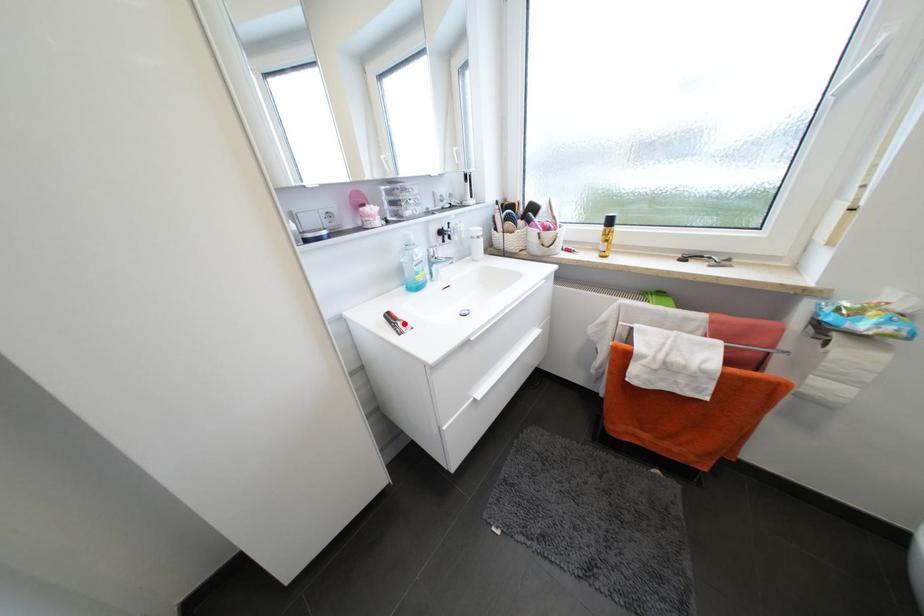
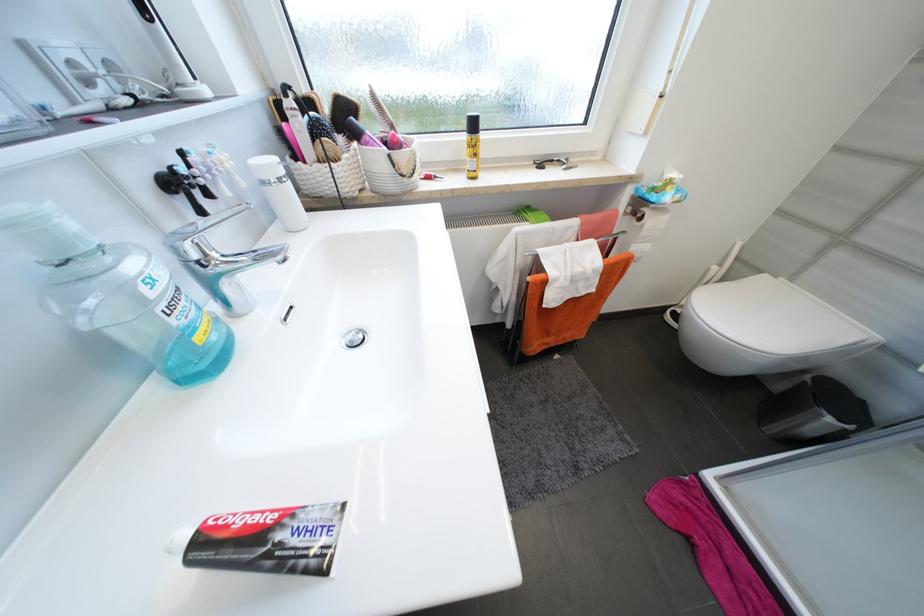
Where in the second image is the point corresponding to the highlighted location from the first image?

(285, 537)